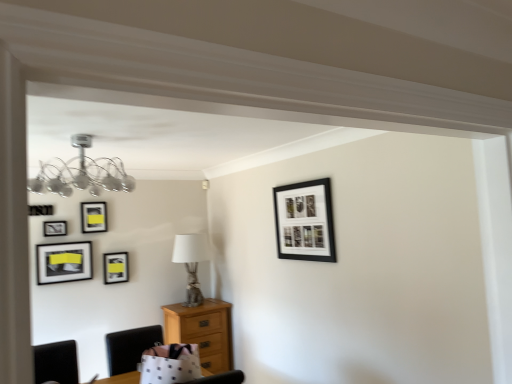
Question: From a real-world perspective, is matte black picture frame at upper left, the 1th picture frame from the left, over light brown wooden chest of drawers at lower left?

Choices:
 (A) no
 (B) yes

Answer: (B)

Question: Is matte black picture frame at upper left, which is the third picture frame in back-to-front order, thinner than light brown wooden chest of drawers at lower left?

Choices:
 (A) yes
 (B) no

Answer: (A)

Question: Can you confirm if matte black picture frame at upper left, arranged as the 3th picture frame when viewed from the front, is positioned to the right of light brown wooden chest of drawers at lower left?

Choices:
 (A) yes
 (B) no

Answer: (B)

Question: Can we say matte black picture frame at upper left, marked as the fifth picture frame in a right-to-left arrangement, lies outside light brown wooden chest of drawers at lower left?

Choices:
 (A) yes
 (B) no

Answer: (A)

Question: Is the depth of matte black picture frame at upper left, marked as the fifth picture frame in a right-to-left arrangement, less than that of light brown wooden chest of drawers at lower left?

Choices:
 (A) no
 (B) yes

Answer: (B)

Question: From the image's perspective, is matte black picture frame at upper left, marked as the fifth picture frame in a right-to-left arrangement, below light brown wooden chest of drawers at lower left?

Choices:
 (A) no
 (B) yes

Answer: (A)

Question: From a real-world perspective, is matte black picture frame at upper left, which is the 3th picture frame in left-to-right order, positioned over matte black picture frame at upper left, the 1th picture frame in the back-to-front sequence, based on gravity?

Choices:
 (A) no
 (B) yes

Answer: (B)

Question: Considering the relative sizes of matte black picture frame at upper left, which ranks as the 2th picture frame in back-to-front order, and matte black picture frame at upper left, the 4th picture frame positioned from the left, in the image provided, is matte black picture frame at upper left, which ranks as the 2th picture frame in back-to-front order, bigger than matte black picture frame at upper left, the 4th picture frame positioned from the left,?

Choices:
 (A) yes
 (B) no

Answer: (A)

Question: Does matte black picture frame at upper left, the fourth picture frame positioned from the front, have a greater width compared to matte black picture frame at upper left, placed as the 2th picture frame when sorted from right to left?

Choices:
 (A) no
 (B) yes

Answer: (A)

Question: Are matte black picture frame at upper left, which is the 3th picture frame in left-to-right order, and matte black picture frame at upper left, the 4th picture frame positioned from the left, located far from each other?

Choices:
 (A) no
 (B) yes

Answer: (A)

Question: Is matte black picture frame at upper left, the fourth picture frame positioned from the front, positioned behind matte black picture frame at upper left, the 1th picture frame in the back-to-front sequence?

Choices:
 (A) yes
 (B) no

Answer: (B)

Question: Is the surface of matte black picture frame at upper left, which is the 3th picture frame in left-to-right order, in direct contact with matte black picture frame at upper left, placed as the 2th picture frame when sorted from right to left?

Choices:
 (A) yes
 (B) no

Answer: (B)

Question: From the image's perspective, is matte black picture frame at upper left, which is the 3th picture frame in left-to-right order, on top of light brown wooden chest of drawers at lower left?

Choices:
 (A) no
 (B) yes

Answer: (B)